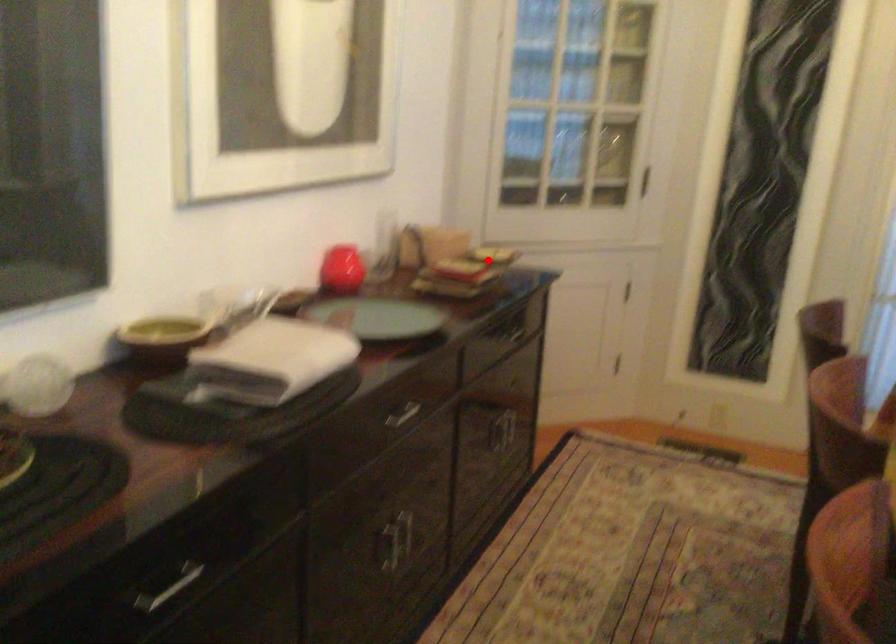
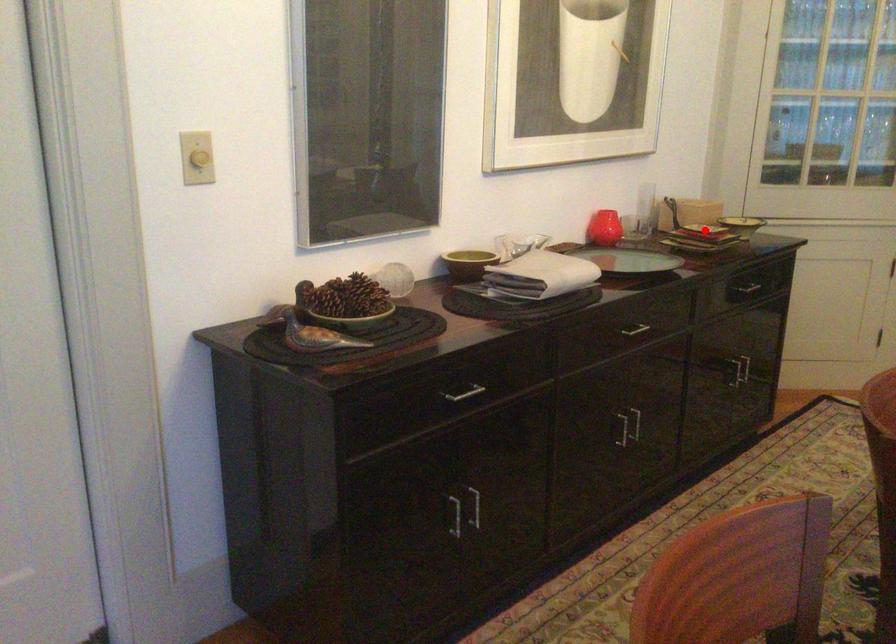
I am providing you with two images of the same scene from different viewpoints. A red point is marked on the first image and another point is marked on the second image. Do the highlighted points in image1 and image2 indicate the same real-world spot?

No